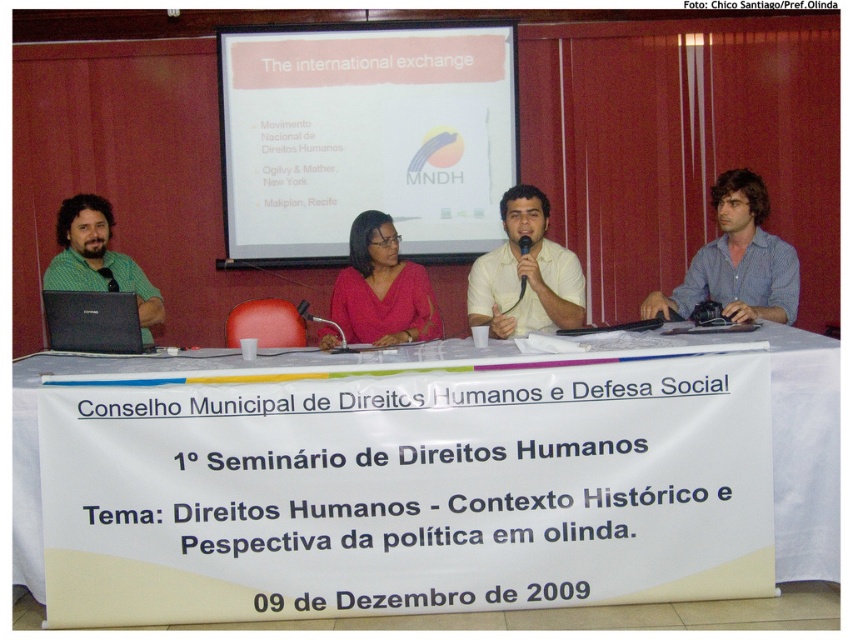
Does white shirt at center come in front of black matte laptop at left?

That is False.

Who is positioned more to the right, white shirt at center or black matte laptop at left?

white shirt at center is more to the right.

Identify the location of white shirt at center. Image resolution: width=853 pixels, height=640 pixels. (525, 273).

Can you confirm if white shirt at center is positioned above black plastic microphone at upper center?

No, white shirt at center is not above black plastic microphone at upper center.

Between point (531, 282) and point (108, 276), which one is positioned in front?

Point (531, 282) is more forward.

The image size is (853, 640). Find the location of `white shirt at center`. white shirt at center is located at coordinates (525, 273).

Which is more to the right, matte black microphone at center or black plastic microphone at upper center?

From the viewer's perspective, matte black microphone at center appears more on the right side.

Between matte black microphone at center and black plastic microphone at upper center, which one is positioned lower?

matte black microphone at center

Is point (332, 323) less distant than point (102, 273)?

Yes, point (332, 323) is in front of point (102, 273).

Locate an element on the screen. The image size is (853, 640). matte black microphone at center is located at coordinates (321, 321).